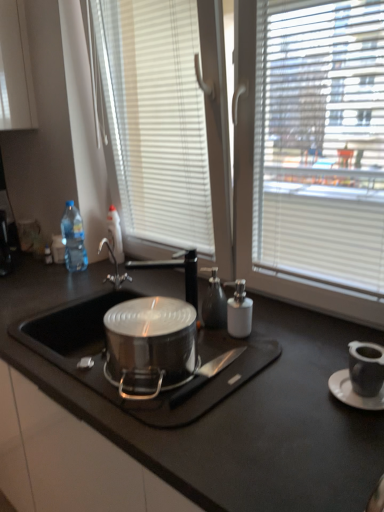
Image resolution: width=384 pixels, height=512 pixels. Find the location of `vacant space in front of black matte knife at center`. vacant space in front of black matte knife at center is located at coordinates [x=196, y=403].